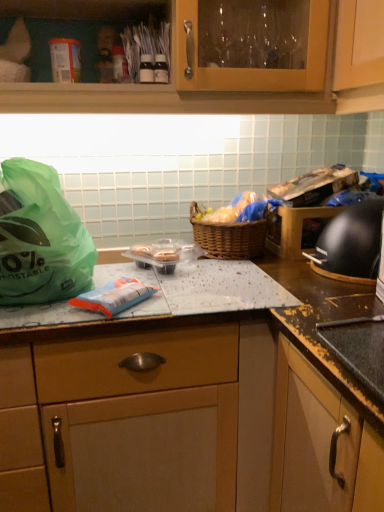
Question: Considering their positions, is black granite countertop at center located in front of or behind green plastic bag at left?

Choices:
 (A) front
 (B) behind

Answer: (A)

Question: From a real-world perspective, is black granite countertop at center physically located above or below green plastic bag at left?

Choices:
 (A) above
 (B) below

Answer: (B)

Question: Based on their relative distances, which object is nearer to the woven brown picnic basket at center?

Choices:
 (A) green plastic bag at left
 (B) black matte gas stove at right
 (C) white cardboard canister at upper left
 (D) brown woven basket at center
 (E) black granite countertop at center

Answer: (D)

Question: Estimate the real-world distances between objects in this image. Which object is farther from the woven brown picnic basket at center?

Choices:
 (A) black granite countertop at center
 (B) brown woven basket at center
 (C) white cardboard canister at upper left
 (D) green plastic bag at left
 (E) black matte gas stove at right

Answer: (C)